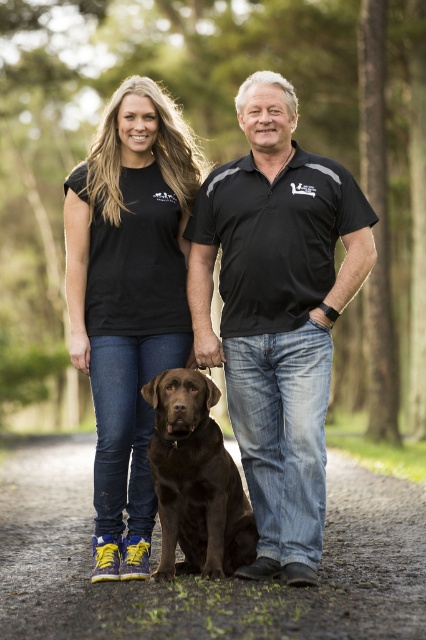
Does black cotton polo shirt at center appear on the right side of black matte t-shirt at center?

Yes, black cotton polo shirt at center is to the right of black matte t-shirt at center.

From the picture: Who is positioned more to the left, black cotton polo shirt at center or black matte t-shirt at center?

black matte t-shirt at center is more to the left.

The height and width of the screenshot is (640, 426). What are the coordinates of `black cotton polo shirt at center` in the screenshot? It's located at (278, 314).

At what (x,y) coordinates should I click in order to perform the action: click on black cotton polo shirt at center. Please return your answer as a coordinate pair (x, y). Image resolution: width=426 pixels, height=640 pixels. Looking at the image, I should click on (278, 314).

Who is more forward, (305, 376) or (304, 588)?

Point (304, 588) is in front.

Looking at this image, can you confirm if black cotton polo shirt at center is positioned above dirt path at center?

Correct, black cotton polo shirt at center is located above dirt path at center.

Between point (284, 400) and point (388, 579), which one is positioned in front?

Positioned in front is point (388, 579).

In order to click on black cotton polo shirt at center in this screenshot , I will do `click(278, 314)`.

Is black cotton polo shirt at center to the right of shiny brown dog at center from the viewer's perspective?

Correct, you'll find black cotton polo shirt at center to the right of shiny brown dog at center.

Does black cotton polo shirt at center have a lesser width compared to shiny brown dog at center?

Incorrect, black cotton polo shirt at center's width is not less than shiny brown dog at center's.

Measure the distance between black cotton polo shirt at center and camera.

black cotton polo shirt at center is 5.76 meters away from camera.

The height and width of the screenshot is (640, 426). Find the location of `black cotton polo shirt at center`. black cotton polo shirt at center is located at coordinates (278, 314).